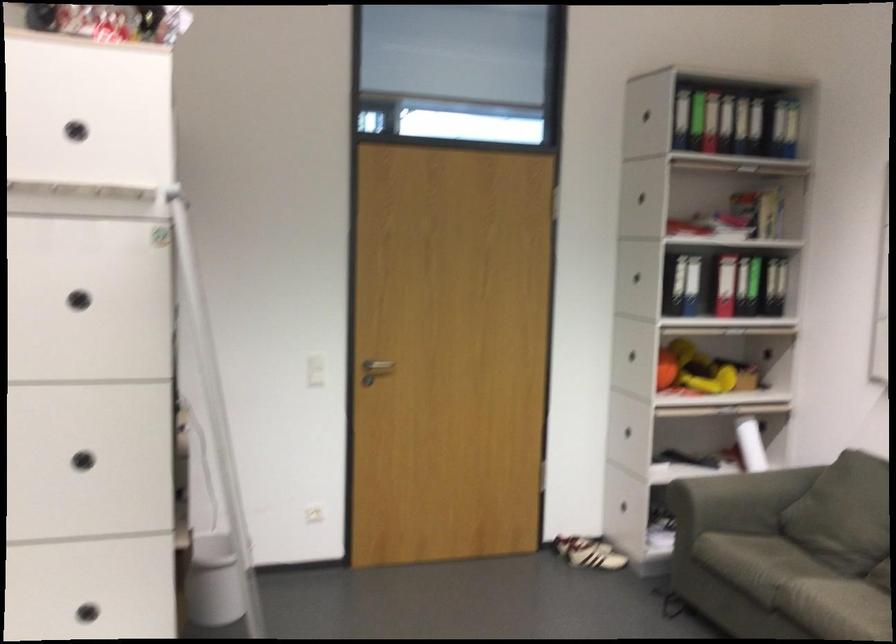
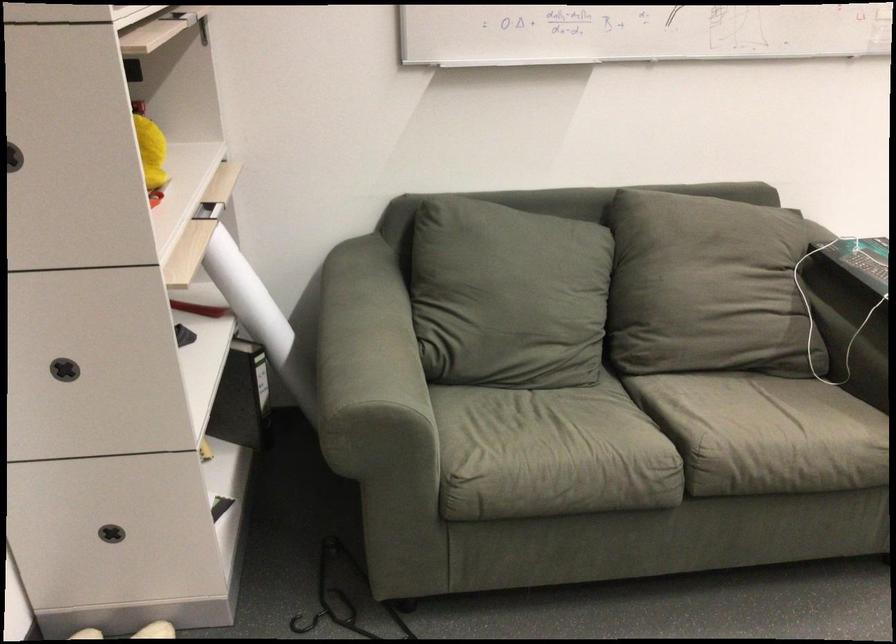
Locate, in the second image, the point that corresponds to pixel 724 371 in the first image.

(151, 152)